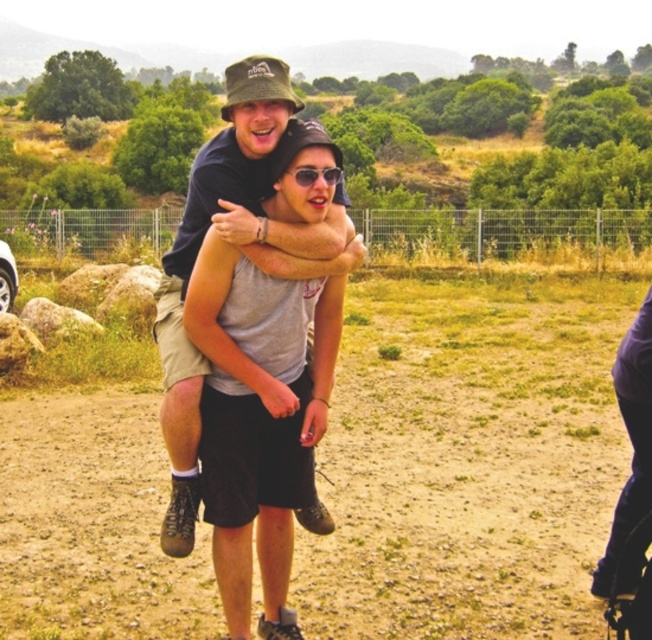
Who is more distant from viewer, [537,484] or [336,180]?

Point [537,484]

Consider the image. Is dull brown dirt at center to the left of sunglasses at center from the viewer's perspective?

In fact, dull brown dirt at center is to the right of sunglasses at center.

Looking at this image, measure the distance between dull brown dirt at center and camera.

dull brown dirt at center is 4.18 meters away from camera.

Identify the location of dull brown dirt at center. (467, 461).

Does matte black shirt at center come behind sunglasses at center?

Yes, matte black shirt at center is further from the viewer.

Locate an element on the screen. This screenshot has width=652, height=640. matte black shirt at center is located at coordinates (239, 248).

Is point (623, 472) positioned in front of point (235, 76)?

That is False.

Who is lower down, dull brown dirt at center or matte black shirt at center?

dull brown dirt at center

Who is more forward, (404, 337) or (170, 467)?

Positioned in front is point (170, 467).

You are a GUI agent. You are given a task and a screenshot of the screen. Output one action in this format:
    pyautogui.click(x=<x>, y=<y>)
    Task: Click on the dull brown dirt at center
    The image size is (652, 640).
    Given the screenshot: What is the action you would take?
    pyautogui.click(x=467, y=461)